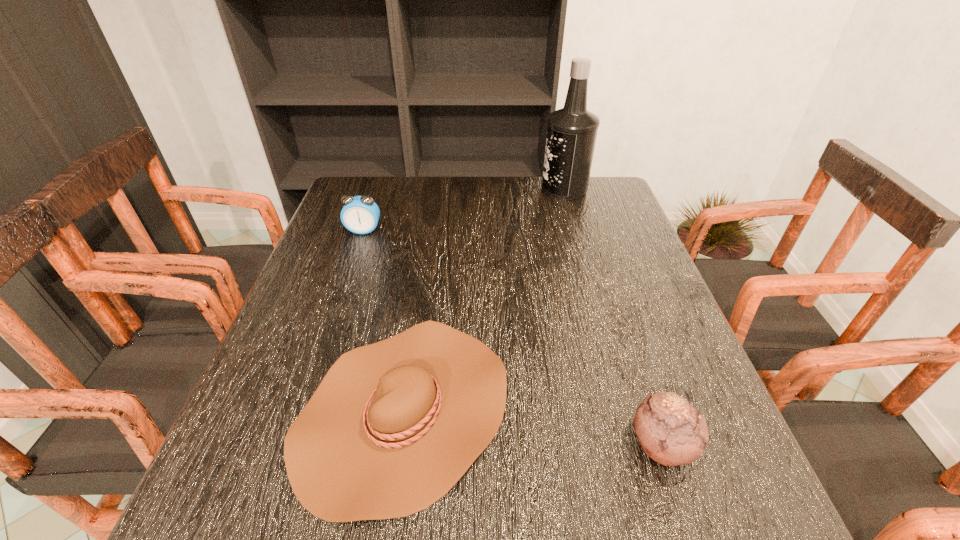
At what (x,y) coordinates should I click in order to perform the action: click on free space between the alarm clock and the cowboy hat. Please return your answer as a coordinate pair (x, y). This screenshot has height=540, width=960. Looking at the image, I should click on (384, 321).

The height and width of the screenshot is (540, 960). Identify the location of free space between the third nearest object and the muffin. (513, 338).

You are a GUI agent. You are given a task and a screenshot of the screen. Output one action in this format:
    pyautogui.click(x=<x>, y=<y>)
    Task: Click on the vacant area that lies between the tallest object and the muffin
    
    Given the screenshot: What is the action you would take?
    tap(612, 316)

Find the location of a particular element. unoccupied position between the alarm clock and the muffin is located at coordinates (513, 338).

This screenshot has height=540, width=960. In order to click on free area in between the muffin and the shortest object in this screenshot , I will do `click(533, 428)`.

Locate an element on the screen. The image size is (960, 540). empty space that is in between the alarm clock and the cowboy hat is located at coordinates (384, 321).

Point out which object is positioned as the second nearest to the tallest object. Please provide its 2D coordinates. Your answer should be formatted as a tuple, i.e. [(x, y)], where the tuple contains the x and y coordinates of a point satisfying the conditions above.

[(393, 426)]

The image size is (960, 540). What are the coordinates of `object that is the closest one to the cowboy hat` in the screenshot? It's located at [x=671, y=431].

I want to click on vacant area in the image that satisfies the following two spatial constraints: 1. on the front label of the muffin; 2. on the right side of the tallest object, so click(637, 444).

Locate an element on the screen. The height and width of the screenshot is (540, 960). free spot that satisfies the following two spatial constraints: 1. on the front label of the liquor; 2. on the left side of the muffin is located at coordinates (637, 444).